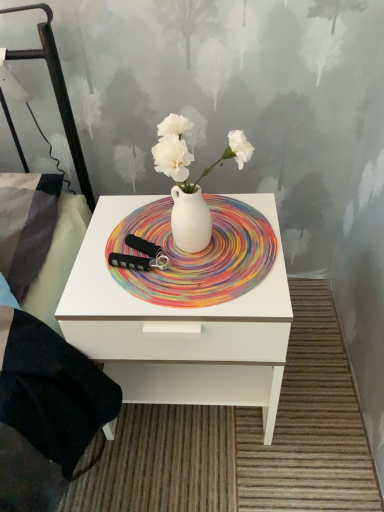
Identify the location of free spot behind white matte vase at center. (205, 202).